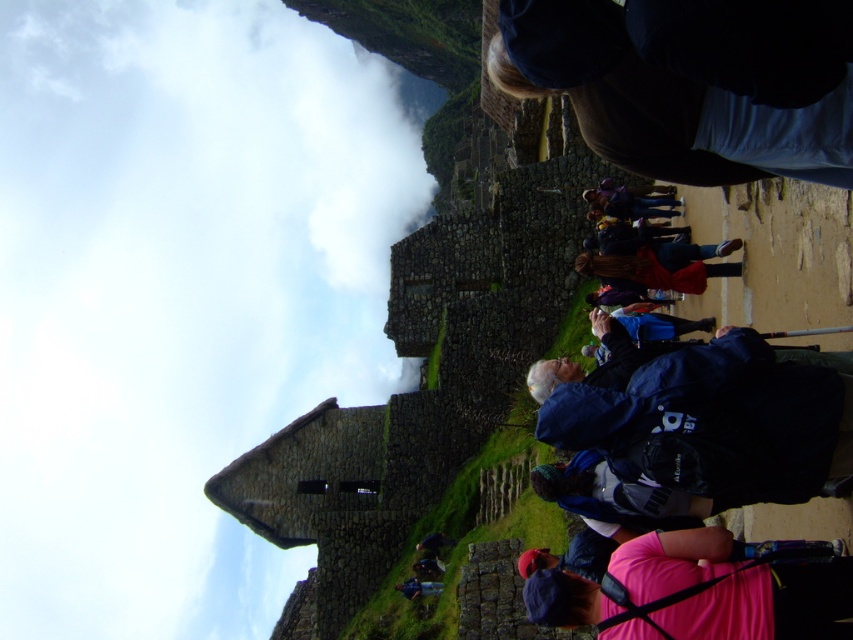
Is white fluffy cloud at upper left bigger than blue fabric backpack at lower right?

Yes.

Between white fluffy cloud at upper left and blue fabric backpack at lower right, which one appears on the right side from the viewer's perspective?

From the viewer's perspective, blue fabric backpack at lower right appears more on the right side.

Does point (18, 525) come closer to viewer compared to point (718, 429)?

No.

Locate an element on the screen. This screenshot has height=640, width=853. white fluffy cloud at upper left is located at coordinates (178, 294).

Can you confirm if blue fabric backpack at lower right is bigger than dark blue fabric at upper right?

Indeed, blue fabric backpack at lower right has a larger size compared to dark blue fabric at upper right.

Is point (763, 385) less distant than point (827, 134)?

No, (763, 385) is further to viewer.

Looking at this image, who is more distant from viewer, (651, 376) or (759, 161)?

The point (651, 376) is more distant.

Identify the location of blue fabric backpack at lower right. (706, 424).

Consider the image. Is dark blue fabric at upper right wider than pink fabric at lower right?

Yes.

Can you confirm if dark blue fabric at upper right is taller than pink fabric at lower right?

Yes, dark blue fabric at upper right is taller than pink fabric at lower right.

Who is more forward, (660, 163) or (811, 604)?

Point (811, 604) is in front.

Identify the location of dark blue fabric at upper right. Image resolution: width=853 pixels, height=640 pixels. (662, 102).